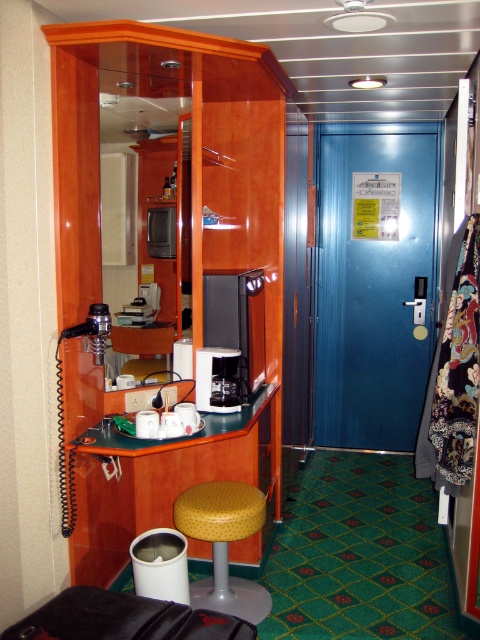
Question: Which point is farther to the camera?

Choices:
 (A) (168, 132)
 (B) (156, 371)
 (C) (148, 602)

Answer: (A)

Question: Which point is farther to the camera?

Choices:
 (A) (210, 410)
 (B) (217, 512)
 (C) (252, 262)
 (D) (171, 324)

Answer: (D)

Question: Does woodenmaterial/texturecloset at center appear over yellow fabric stool at lower center?

Choices:
 (A) no
 (B) yes

Answer: (B)

Question: In this image, where is woodenmaterial/texturecloset at center located relative to yellow textured stool at center?

Choices:
 (A) below
 (B) above

Answer: (B)

Question: Is yellow textured stool at center smaller than satin black coffee machine at center?

Choices:
 (A) yes
 (B) no

Answer: (B)

Question: Which of the following is the closest to the observer?

Choices:
 (A) yellow fabric stool at lower center
 (B) yellow textured stool at center
 (C) satin black coffee machine at center
 (D) leather-like black hassock at lower center

Answer: (D)